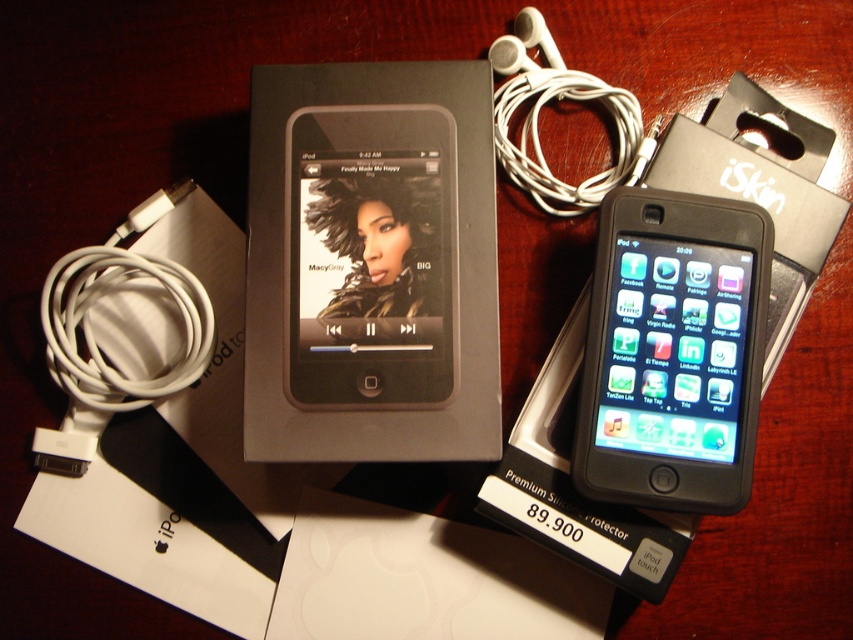
Question: Estimate the real-world distances between objects in this image. Which object is farther from the black matte ipod at center?

Choices:
 (A) black matte ipod at upper center
 (B) white rubber cable at lower left

Answer: (A)

Question: Can you confirm if black matte ipod at center is positioned to the left of black matte ipod at upper center?

Choices:
 (A) yes
 (B) no

Answer: (A)

Question: Does black matte ipod at upper center lie in front of white rubber cable at lower left?

Choices:
 (A) yes
 (B) no

Answer: (A)

Question: Is black matte ipod at upper center positioned behind white rubber cable at lower left?

Choices:
 (A) no
 (B) yes

Answer: (A)

Question: Which of the following is the closest to the observer?

Choices:
 (A) white rubber cable at lower left
 (B) black matte ipod at upper center
 (C) black matte ipod at center

Answer: (B)

Question: Which object is positioned closest to the black matte ipod at center?

Choices:
 (A) white rubber cable at lower left
 (B) black matte ipod at upper center

Answer: (A)